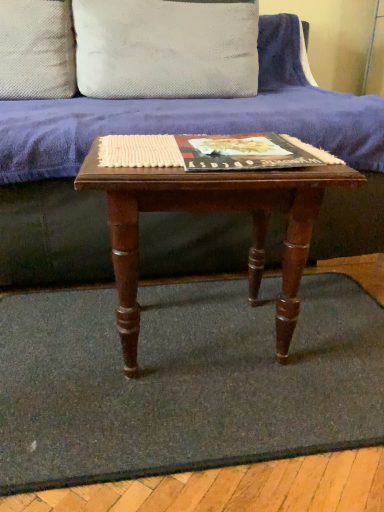
Question: Is velvet purple couch at center bigger or smaller than wooden table at center?

Choices:
 (A) big
 (B) small

Answer: (A)

Question: Is velvet purple couch at center in front of or behind wooden table at center in the image?

Choices:
 (A) front
 (B) behind

Answer: (B)

Question: Which object is the farthest from the wooden table at center?

Choices:
 (A) matte hardcover book at center
 (B) velvet purple couch at center
 (C) gray carpet at center
 (D) white textured pillow at upper center, which is the first pillow in right-to-left order
 (E) white dotted fabric pillow at upper center, acting as the first pillow starting from the left

Answer: (E)

Question: Which is nearer to the velvet purple couch at center?

Choices:
 (A) wooden table at center
 (B) white textured pillow at upper center, which is the first pillow in right-to-left order
 (C) white dotted fabric pillow at upper center, positioned as the second pillow in right-to-left order
 (D) gray carpet at center
 (E) matte hardcover book at center

Answer: (A)